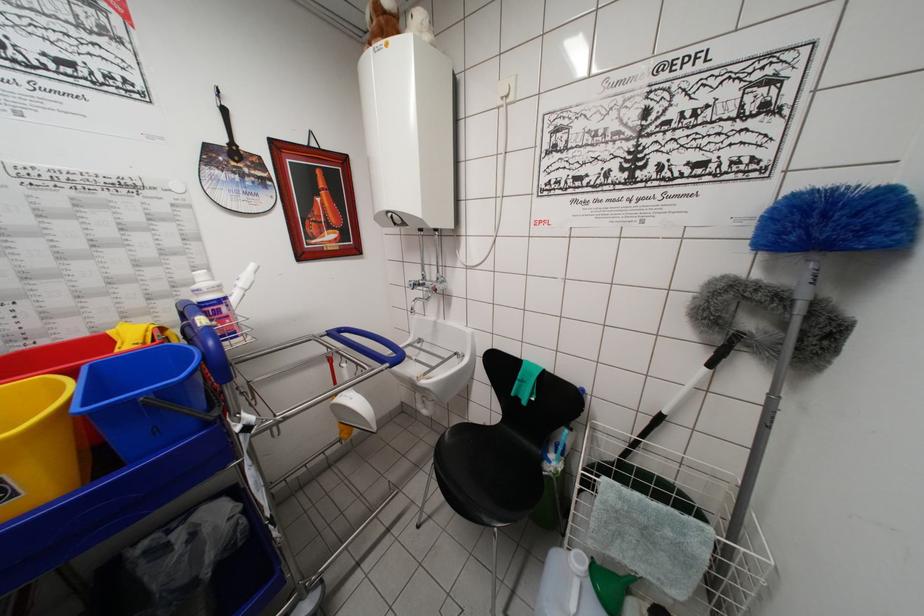
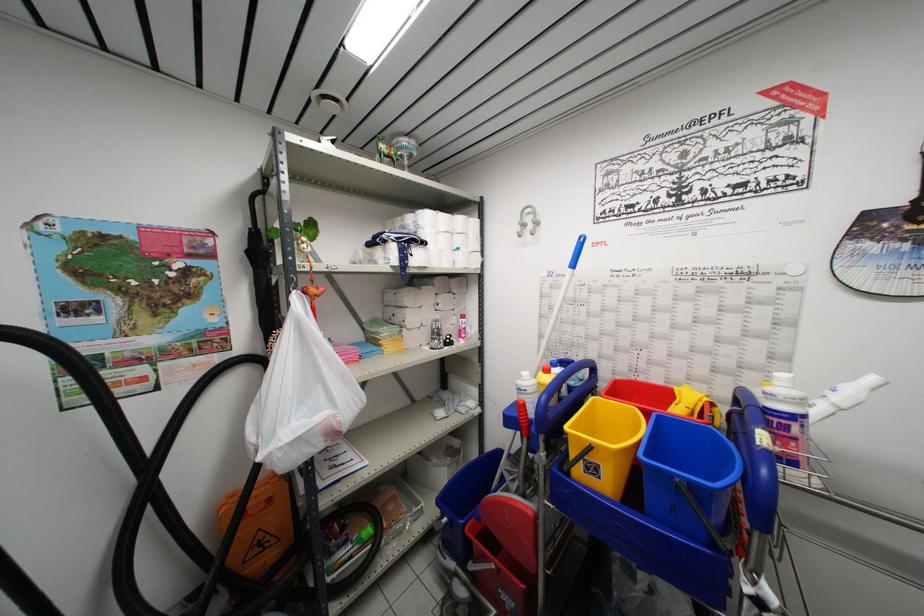
Question: Based on the continuous images, in which direction is the camera rotating? Reply with the corresponding letter.

Choices:
 (A) Left
 (B) Right
 (C) Up
 (D) Down

Answer: (A)